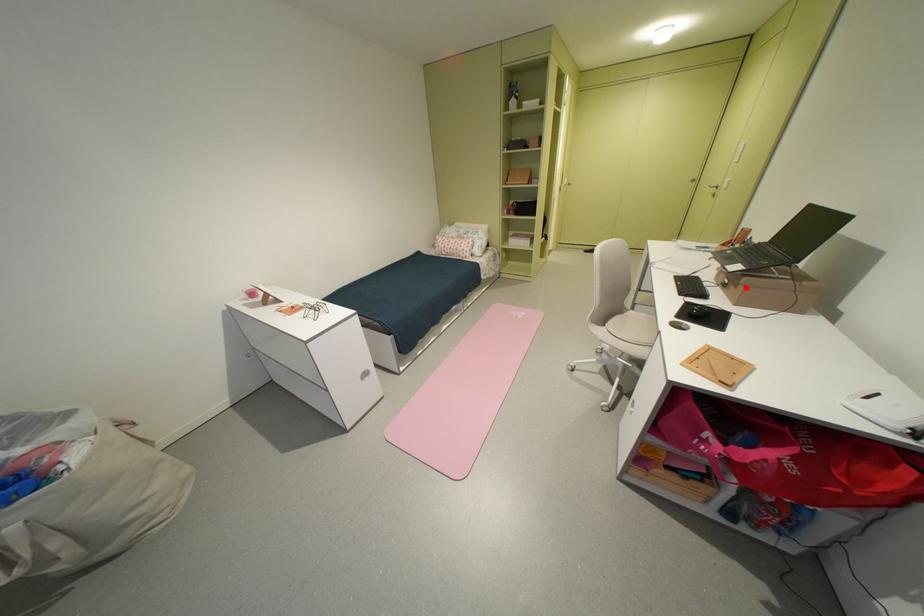
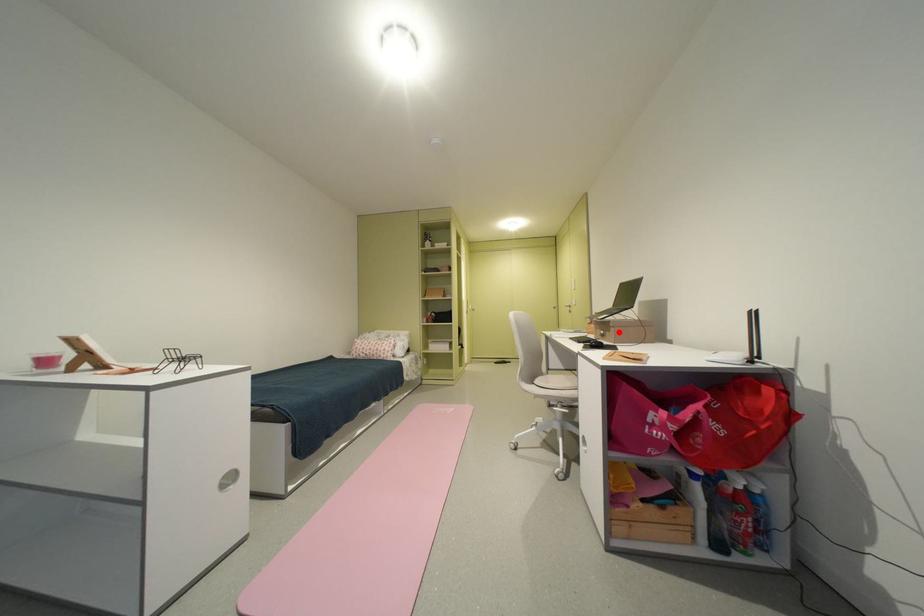
I am providing you with two images of the same scene from different viewpoints. A red point is marked on the first image and another point is marked on the second image. Is the red point in image1 aligned with the point shown in image2?

Yes